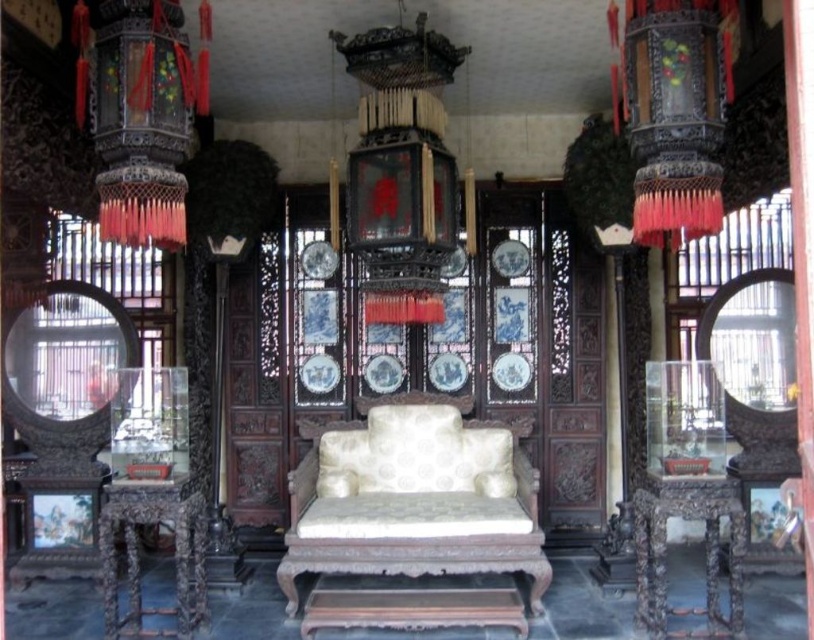
You are standing in the grand hall and want to sit on the white upholstered armchair at center. From your current position near the black lacquered lantern at left, which direction should you move to reach the chair?

You should move to your right to reach the white upholstered armchair at center because it is positioned to the right of the black lacquered lantern at left.

You are standing in the grand hall and need to locate the white upholstered armchair at center. From your current position facing the entrance, which direction should you turn to find the black lacquered lantern at upper right?

The white upholstered armchair at center is to the left of the black lacquered lantern at upper right. So, if you are facing the entrance and want to find the black lacquered lantern at upper right, you should turn to your right since the lantern is on the right side relative to the armchair.